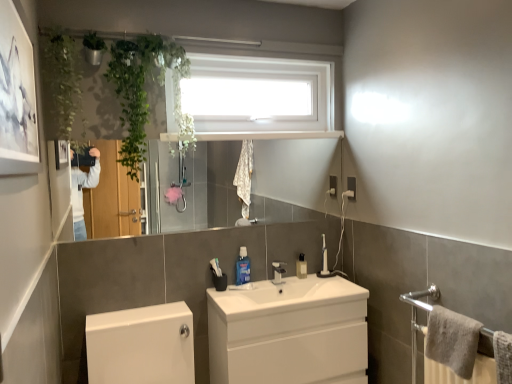
The width and height of the screenshot is (512, 384). Describe the element at coordinates (289, 332) in the screenshot. I see `white glossy cabinet at center` at that location.

What do you see at coordinates (278, 272) in the screenshot?
I see `white plastic tap at center` at bounding box center [278, 272].

What do you see at coordinates (453, 340) in the screenshot? I see `gray cotton towel at right` at bounding box center [453, 340].

This screenshot has height=384, width=512. What do you see at coordinates (183, 190) in the screenshot?
I see `metallic silver mirror at upper center` at bounding box center [183, 190].

What do you see at coordinates (61, 79) in the screenshot?
I see `green leafy plant at upper left` at bounding box center [61, 79].

Locate an element on the screen. white glossy cabinet at center is located at coordinates [x=289, y=332].

Considering the relative positions of white plastic tap at center and gray cotton towel at right in the image provided, is white plastic tap at center to the right of gray cotton towel at right from the viewer's perspective?

No, white plastic tap at center is not to the right of gray cotton towel at right.

Is the position of white plastic tap at center more distant than that of gray cotton towel at right?

Yes, it is.

From the image's perspective, which object appears higher, white plastic tap at center or gray cotton towel at right?

white plastic tap at center appears higher in the image.

Is point (454, 365) farther from camera compared to point (215, 107)?

No.

Is gray cotton towel at right facing towards white plastic window at upper center?

No, gray cotton towel at right is not turned towards white plastic window at upper center.

Consider the image. Is gray cotton towel at right wider or thinner than white plastic window at upper center?

Clearly, gray cotton towel at right has less width compared to white plastic window at upper center.

Who is shorter, gray cotton towel at right or white plastic window at upper center?

gray cotton towel at right.

Is white glossy cabinet at center aimed at white plastic window at upper center?

No.

From the image's perspective, is white glossy cabinet at center on top of white plastic window at upper center?

No, from the image's perspective, white glossy cabinet at center is not on top of white plastic window at upper center.

Who is bigger, white glossy cabinet at center or white plastic window at upper center?

With larger size is white glossy cabinet at center.

Considering the sizes of objects white glossy cabinet at center and white plastic window at upper center in the image provided, who is wider, white glossy cabinet at center or white plastic window at upper center?

white glossy cabinet at center.

Between blue glossy mouthwash at center, which appears as the second toiletry when viewed from the back, and gray cotton towel at right, which one has smaller width?

blue glossy mouthwash at center, which appears as the second toiletry when viewed from the back.

Could you tell me if blue glossy mouthwash at center, which appears as the second toiletry when viewed from the back, is turned towards gray cotton towel at right?

No.

Where is `bath towel below the blue glossy mouthwash at center, which ranks as the 2th toiletry in right-to-left order (from a real-world perspective)`? The width and height of the screenshot is (512, 384). bath towel below the blue glossy mouthwash at center, which ranks as the 2th toiletry in right-to-left order (from a real-world perspective) is located at coordinates (453, 340).

In the scene shown: From a real-world perspective, is blue glossy mouthwash at center, the 1th toiletry in the front-to-back sequence, located higher than gray cotton towel at right?

Yes, from a real-world perspective, blue glossy mouthwash at center, the 1th toiletry in the front-to-back sequence, is over gray cotton towel at right

Can you confirm if metallic silver mirror at upper center is bigger than gray cotton towel at right?

Yes, metallic silver mirror at upper center is bigger than gray cotton towel at right.

Which is behind, metallic silver mirror at upper center or gray cotton towel at right?

Positioned behind is metallic silver mirror at upper center.

Between metallic silver mirror at upper center and gray cotton towel at right, which one appears on the left side from the viewer's perspective?

metallic silver mirror at upper center.

In the scene shown: Which object is wider, metallic silver mirror at upper center or gray cotton towel at right?

gray cotton towel at right.

Find the location of a particular element. The height and width of the screenshot is (384, 512). bath below the green leafy plant at upper left (from the image's perspective) is located at coordinates (141, 345).

Which object is more forward, green leafy plant at upper left or white glossy toilet at lower left?

white glossy toilet at lower left is closer to the camera.

From a real-world perspective, is green leafy plant at upper left on top of white glossy toilet at lower left?

Yes, from a real-world perspective, green leafy plant at upper left is above white glossy toilet at lower left.

Is green leafy plant at upper left not near white glossy toilet at lower left?

Yes.

From a real-world perspective, is white glossy sink at center physically above blue glossy mouthwash at center, the first toiletry viewed from the left?

No.

What's the angular difference between white glossy sink at center and blue glossy mouthwash at center, which ranks as the 2th toiletry in right-to-left order,'s facing directions?

0.805 degrees separate the facing orientations of white glossy sink at center and blue glossy mouthwash at center, which ranks as the 2th toiletry in right-to-left order.

Does white glossy sink at center have a smaller size compared to blue glossy mouthwash at center, the 1th toiletry in the front-to-back sequence?

No, white glossy sink at center is not smaller than blue glossy mouthwash at center, the 1th toiletry in the front-to-back sequence.

In order to click on tap that is behind the gray cotton towel at right in this screenshot , I will do `click(278, 272)`.

You are a GUI agent. You are given a task and a screenshot of the screen. Output one action in this format:
    pyautogui.click(x=<x>, y=<y>)
    Task: Click on the window above the gray cotton towel at right (from the image's perspective)
    The width and height of the screenshot is (512, 384).
    Given the screenshot: What is the action you would take?
    pyautogui.click(x=259, y=97)

Estimate the real-world distances between objects in this image. Which object is closer to metallic silver mirror at upper center, translucent plastic bottle at center, which is the 1th toiletry in right-to-left order, or white plastic tap at center?

white plastic tap at center.

Considering their positions, is green leafy plant at upper left positioned closer to white plastic window at upper center than white glossy cabinet at center?

Among the two, green leafy plant at upper left is located nearer to white plastic window at upper center.

Looking at the image, which one is located further to white plastic window at upper center, green leafy plant at upper left or metallic silver mirror at upper center?

metallic silver mirror at upper center.

Which object lies further to the anchor point white plastic window at upper center, blue glossy mouthwash at center, the first toiletry viewed from the left, or white glossy toilet at lower left?

white glossy toilet at lower left is positioned further to the anchor white plastic window at upper center.

Based on their spatial positions, is blue glossy mouthwash at center, the 1th toiletry in the front-to-back sequence, or gray cotton towel at right further from white glossy sink at center?

gray cotton towel at right lies further to white glossy sink at center than the other object.

Which object lies nearer to the anchor point white glossy cabinet at center, blue glossy mouthwash at center, which ranks as the 2th toiletry in right-to-left order, or white glossy sink at center?

white glossy sink at center.

When comparing their distances from white plastic tap at center, does metallic silver mirror at upper center or white glossy toilet at lower left seem further?

Based on the image, metallic silver mirror at upper center appears to be further to white plastic tap at center.

From the image, which object appears to be nearer to white glossy cabinet at center, green leafy plant at upper left or gray cotton towel at right?

gray cotton towel at right lies closer to white glossy cabinet at center than the other object.

Locate an element on the screen. This screenshot has height=384, width=512. sink between white glossy toilet at lower left and white plastic tap at center from front to back is located at coordinates (286, 297).

This screenshot has width=512, height=384. Find the location of `sink between metallic silver mirror at upper center and white glossy toilet at lower left from top to bottom`. sink between metallic silver mirror at upper center and white glossy toilet at lower left from top to bottom is located at coordinates (286, 297).

Locate an element on the screen. This screenshot has height=384, width=512. window between green leafy plant at upper left and translucent plastic bottle at center, which is the 1th toiletry in right-to-left order, from left to right is located at coordinates (259, 97).

Identify the location of tap between white plastic window at upper center and gray cotton towel at right in the up-down direction. This screenshot has width=512, height=384. (278, 272).